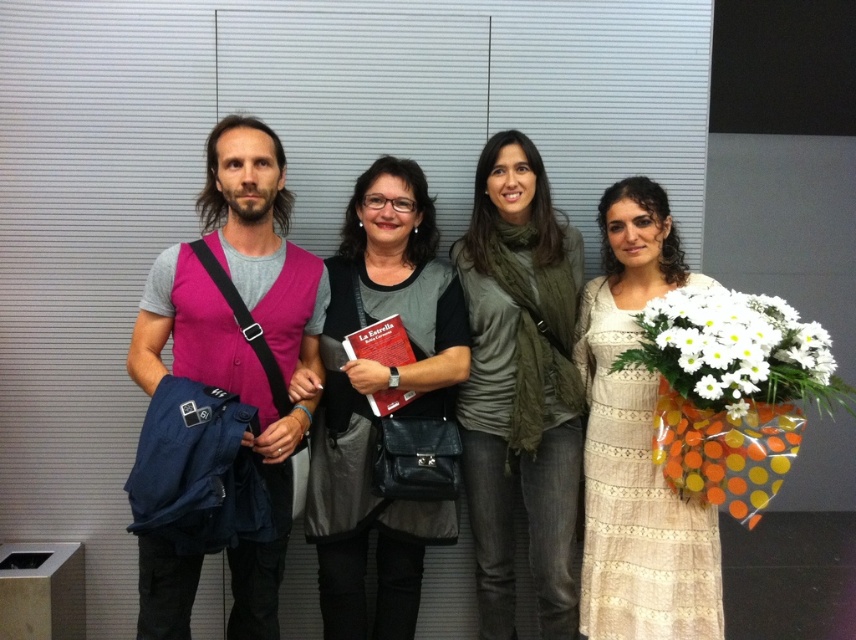
Which of these two, green matte scarf at center or white fabric bouquet at right, stands shorter?

white fabric bouquet at right is shorter.

Can you confirm if green matte scarf at center is positioned to the right of white fabric bouquet at right?

No, green matte scarf at center is not to the right of white fabric bouquet at right.

Which is behind, point (486, 458) or point (664, 317)?

The point (486, 458) is more distant.

The image size is (856, 640). Identify the location of green matte scarf at center. (520, 387).

Is point (152, 280) closer to camera compared to point (318, 497)?

Yes, point (152, 280) is in front of point (318, 497).

Between point (171, 625) and point (423, 328), which one is positioned behind?

The point (423, 328) is more distant.

Between point (268, 570) and point (358, 401), which one is positioned in front?

Positioned in front is point (268, 570).

The width and height of the screenshot is (856, 640). What are the coordinates of `pink fabric vest at left` in the screenshot? It's located at (242, 333).

This screenshot has height=640, width=856. What do you see at coordinates (379, 388) in the screenshot?
I see `matte black book at center` at bounding box center [379, 388].

Between matte black book at center and white paper flower at right, which one has less height?

Standing shorter between the two is white paper flower at right.

Locate an element on the screen. The height and width of the screenshot is (640, 856). matte black book at center is located at coordinates (379, 388).

Identify the location of matte black book at center. The image size is (856, 640). [379, 388].